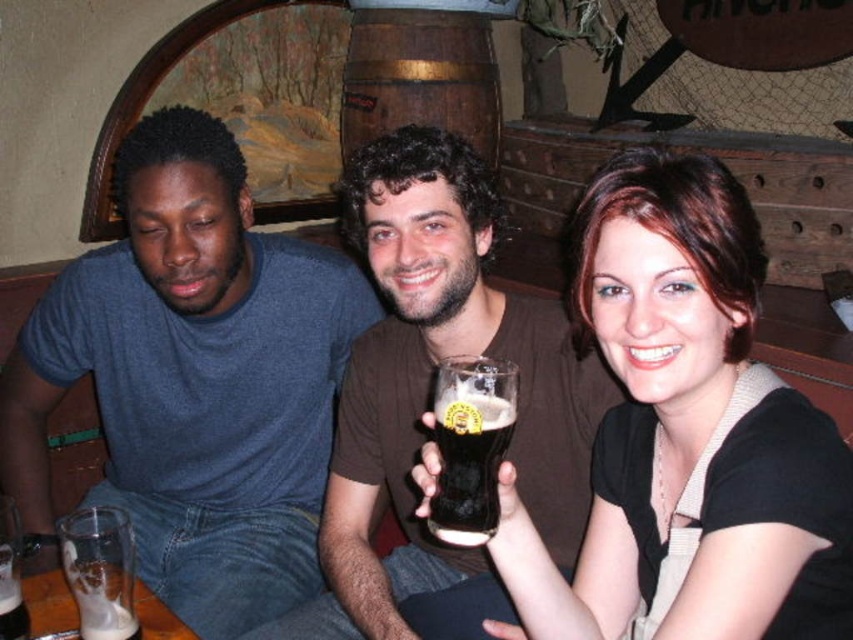
Question: Considering the real-world distances, which object is farthest from the dark brown glass at center?

Choices:
 (A) matte black shirt at center
 (B) brown matte shirt at center
 (C) translucent glass mug at lower left
 (D) clear glass mug at lower left

Answer: (D)

Question: Considering the relative positions of matte black shirt at center and translucent glass mug at lower left in the image provided, where is matte black shirt at center located with respect to translucent glass mug at lower left?

Choices:
 (A) right
 (B) left

Answer: (A)

Question: Estimate the real-world distances between objects in this image. Which object is farther from the dark brown glass at center?

Choices:
 (A) matte blue shirt at left
 (B) clear glass mug at lower left

Answer: (A)

Question: Among these points, which one is nearest to the camera?

Choices:
 (A) (18, 600)
 (B) (77, 284)
 (C) (90, 620)
 (D) (462, 374)

Answer: (D)

Question: Does matte blue shirt at left have a greater width compared to brown matte shirt at center?

Choices:
 (A) no
 (B) yes

Answer: (B)

Question: Can you confirm if brown matte shirt at center is wider than clear glass mug at lower left?

Choices:
 (A) yes
 (B) no

Answer: (A)